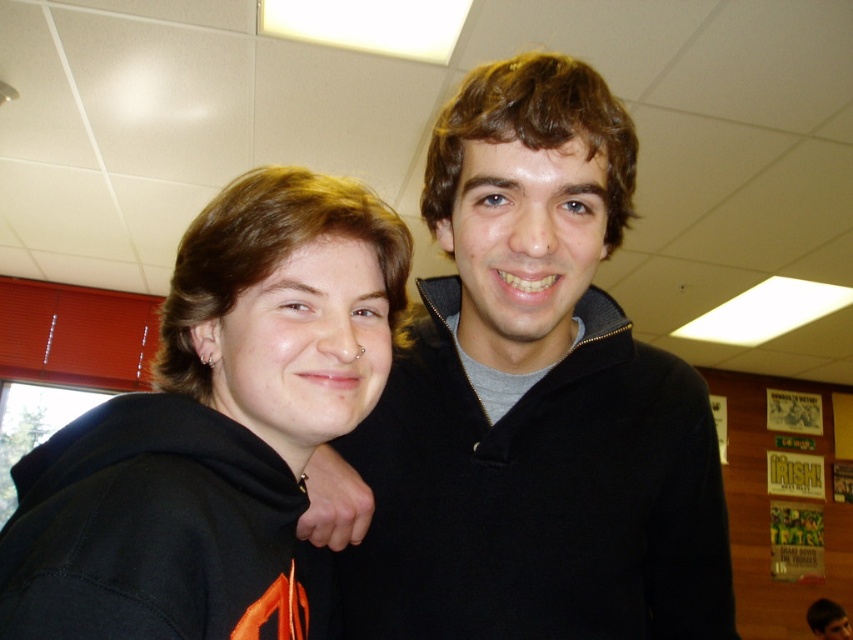
You are a photographer setting up for a group photo. You have two subjects wearing the black hoodie at left and the black matte hoodie at center. The camera you are using has a maximum focus range of 4 meters. Can both subjects be in focus at the same time?

The black hoodie at left and black matte hoodie at center are 4.41 meters apart. Since the camera can only focus up to 4 meters, the distance between them exceeds the focus range. Therefore, both subjects cannot be in focus simultaneously.

You are taking a photo of two friends in a room with red cabinets. You notice two specific points in the image labeled as point (160, 545) and point (845, 614). Which of these points is nearer to the camera?

Point (160, 545) is closer to the camera than point (845, 614).

You are helping organize a clothing donation drive. You have two hoodies to place in boxes. The black hoodie at left and the black matte hoodie at center. The boxes can only fit items up to the size of the smaller hoodie. Which hoodie should you avoid placing in the boxes?

The black hoodie at left has a larger size compared to the black matte hoodie at center, so you should avoid placing the black hoodie at left in the boxes since it exceeds the maximum size allowed.